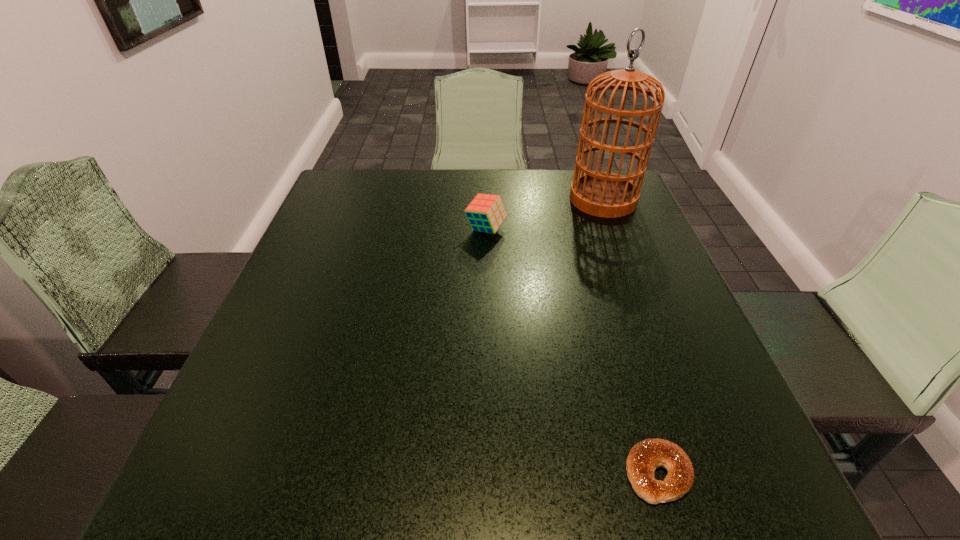
This screenshot has height=540, width=960. Identify the location of birdcage. (603, 194).

This screenshot has width=960, height=540. I want to click on the farthest object, so click(x=603, y=194).

In order to click on the second tallest object in this screenshot , I will do `click(486, 213)`.

Find the location of `the second nearest object`. the second nearest object is located at coordinates (486, 213).

This screenshot has height=540, width=960. What are the coordinates of `the nearest object` in the screenshot? It's located at (643, 459).

You are a GUI agent. You are given a task and a screenshot of the screen. Output one action in this format:
    pyautogui.click(x=<x>, y=<y>)
    Task: Click on the bagel
    The width and height of the screenshot is (960, 540).
    Given the screenshot: What is the action you would take?
    pyautogui.click(x=643, y=459)

Find the location of `vacant space located 0.070m on the back of the birdcage`. vacant space located 0.070m on the back of the birdcage is located at coordinates (592, 171).

This screenshot has height=540, width=960. Find the location of `vacant region located on the front of the second tallest object`. vacant region located on the front of the second tallest object is located at coordinates (489, 343).

What are the coordinates of `free space located on the back of the bagel` in the screenshot? It's located at (640, 415).

The width and height of the screenshot is (960, 540). What are the coordinates of `object present at the far edge` in the screenshot? It's located at (603, 194).